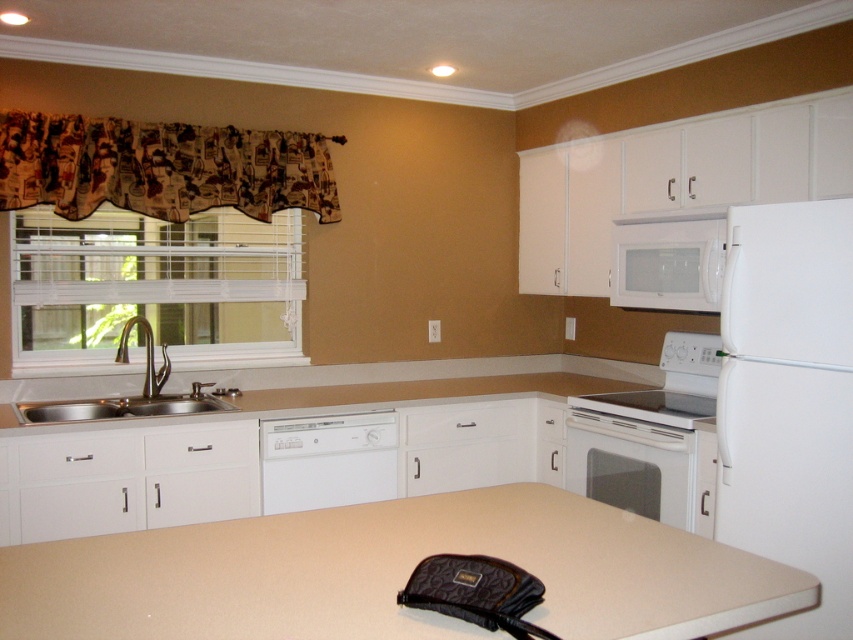
You are a chef preparing a large platter that requires 1.5 meters of counter space. You have the beige laminate counter top at center and the white matte refrigerator at right available. Which surface can accommodate your platter?

The beige laminate counter top at center has a larger width than the white matte refrigerator at right, so it can accommodate the platter requiring 1.5 meters of counter space.

You are a chef preparing to cook a meal. You need to boil water for pasta. You have a pot on the white glossy electric stove at center and need to fill it from the stainless steel sink at left. Can you reach the sink from the stove without moving the pot?

The white glossy electric stove at center is below the stainless steel sink at left, so the stove is positioned lower than the sink. Since the stove is lower, you can easily reach the sink from the stove without needing to move the pot.

You are a chef preparing to cook a meal. You need to boil water for pasta. You have the white glossy electric stove at center and the stainless steel sink at left. Which appliance should you use to boil the water?

You should use the white glossy electric stove at center to boil the water because it is an appliance designed for cooking, while the stainless steel sink at left is for washing and rinsing.